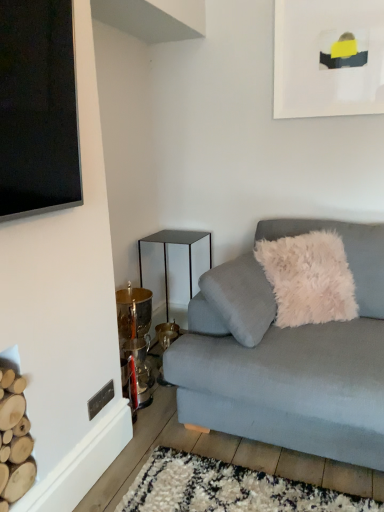
Question: Considering the positions of light gray fabric couch at lower right and white matte picture frame at upper right in the image, is light gray fabric couch at lower right taller or shorter than white matte picture frame at upper right?

Choices:
 (A) tall
 (B) short

Answer: (A)

Question: Considering the positions of light gray fabric couch at lower right and white matte picture frame at upper right in the image, is light gray fabric couch at lower right bigger or smaller than white matte picture frame at upper right?

Choices:
 (A) big
 (B) small

Answer: (A)

Question: Which object is positioned farthest from the white matte picture frame at upper right?

Choices:
 (A) light gray fabric couch at lower right
 (B) metallic/glossy side table at center-left

Answer: (B)

Question: Which object is the farthest from the white matte picture frame at upper right?

Choices:
 (A) light gray fabric couch at lower right
 (B) metallic/glossy side table at center-left

Answer: (B)